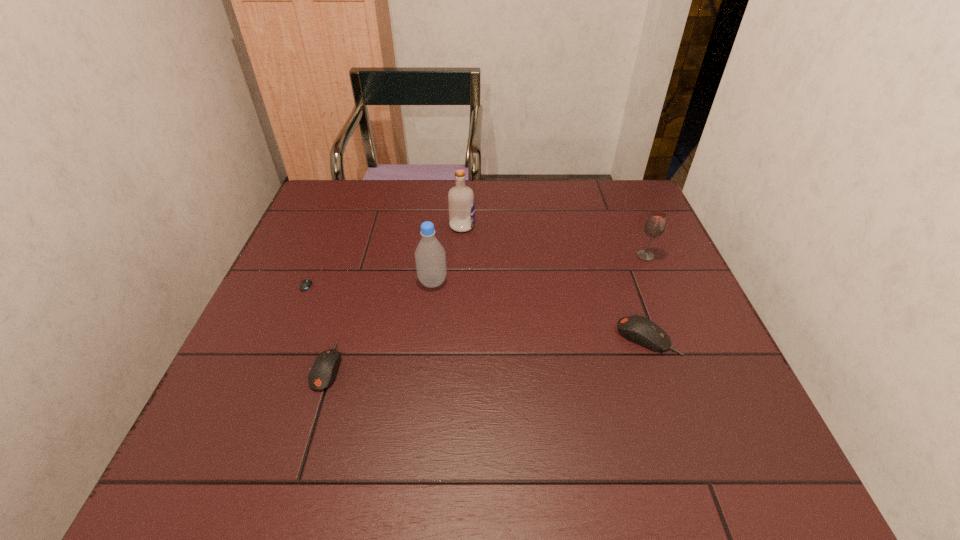
You are a GUI agent. You are given a task and a screenshot of the screen. Output one action in this format:
    pyautogui.click(x=<x>, y=<y>)
    Task: Click on the glass drink container at the right edge
    The width and height of the screenshot is (960, 540).
    Given the screenshot: What is the action you would take?
    pyautogui.click(x=655, y=225)

In the image, there is a desktop. Identify the location of free space at the far edge. This screenshot has width=960, height=540. (560, 210).

You are a GUI agent. You are given a task and a screenshot of the screen. Output one action in this format:
    pyautogui.click(x=<x>, y=<y>)
    Task: Click on the vacant space at the near edge of the desktop
    
    Given the screenshot: What is the action you would take?
    pyautogui.click(x=608, y=401)

I want to click on vacant region at the left edge of the desktop, so [x=253, y=355].

In the image, there is a desktop. Where is `vacant space at the right edge`? vacant space at the right edge is located at coordinates (660, 299).

What are the coordinates of `vacant space at the far right corner of the desktop` in the screenshot? It's located at (609, 181).

Locate an element on the screen. free space at the near right corner is located at coordinates (675, 421).

This screenshot has width=960, height=540. In order to click on empty space that is in between the shortest object and the rightmost mouse in this screenshot , I will do pos(479,308).

What are the coordinates of `free point between the fourth tallest object and the farthest object` in the screenshot? It's located at (555, 281).

Identify the location of free space that is in between the bottle and the vodka. (447, 254).